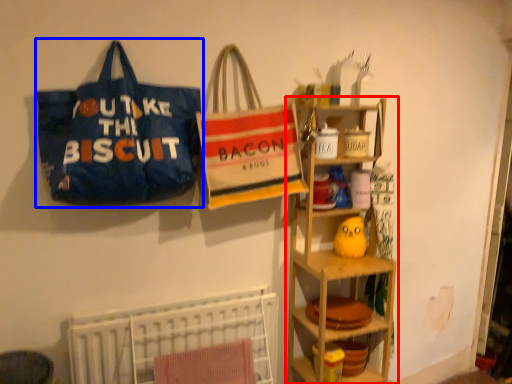
Question: Which object is further to the camera taking this photo, shelf (highlighted by a red box) or handbag (highlighted by a blue box)?

Choices:
 (A) shelf
 (B) handbag

Answer: (A)